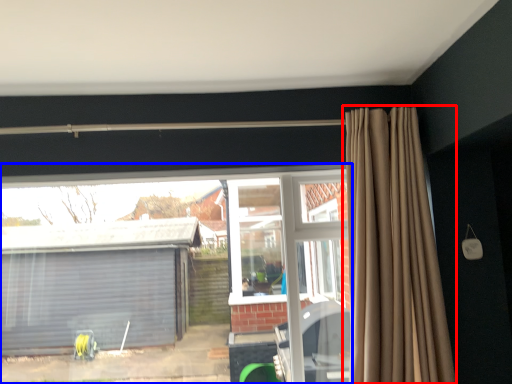
Question: Among these objects, which one is farthest to the camera, curtain (highlighted by a red box) or window (highlighted by a blue box)?

Choices:
 (A) curtain
 (B) window

Answer: (B)